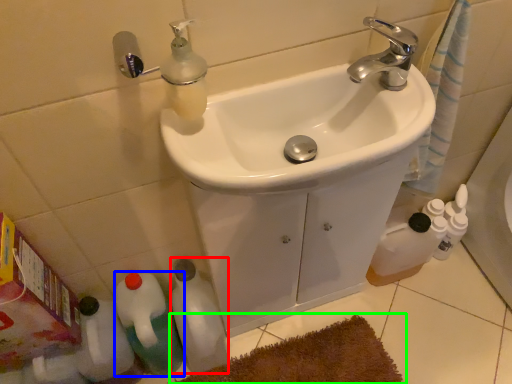
Question: Estimate the real-world distances between objects in this image. Which object is farther from bottle (highlighted by a red box), bottle (highlighted by a blue box) or bath mat (highlighted by a green box)?

Choices:
 (A) bottle
 (B) bath mat

Answer: (B)